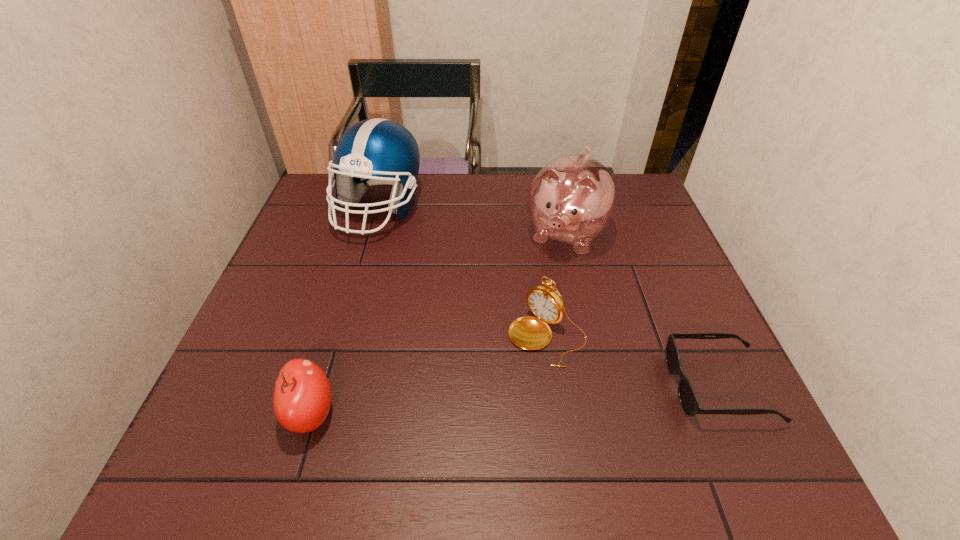
At what (x,y) coordinates should I click in order to perform the action: click on free space on the desktop that is between the apple and the rightmost object and is positioned on the front facing side of the piggy bank. Please return your answer as a coordinate pair (x, y). This screenshot has height=540, width=960. Looking at the image, I should click on [484, 402].

Locate an element on the screen. This screenshot has height=540, width=960. free space on the desktop that is between the apple and the shortest object and is positioned on the face of the pocket watch is located at coordinates (486, 401).

Image resolution: width=960 pixels, height=540 pixels. Find the location of `free space on the desktop that is between the apple and the rightmost object and is positioned at the front of the football helmet with the faceguard`. free space on the desktop that is between the apple and the rightmost object and is positioned at the front of the football helmet with the faceguard is located at coordinates (464, 403).